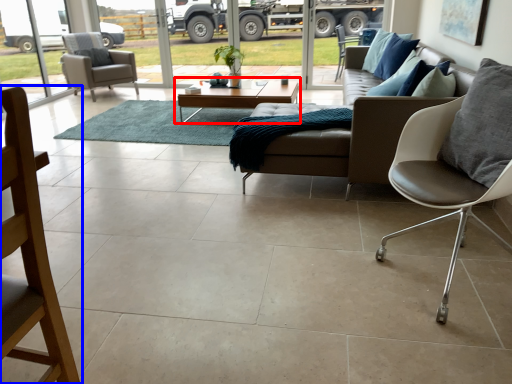
Question: Which of the following is the closest to the observer, coffee table (highlighted by a red box) or chair (highlighted by a blue box)?

Choices:
 (A) coffee table
 (B) chair

Answer: (B)